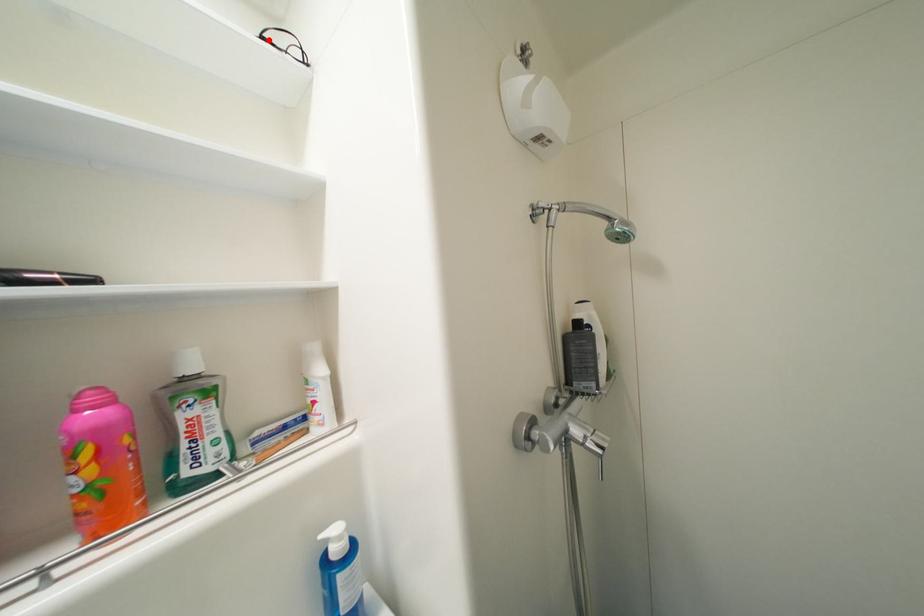
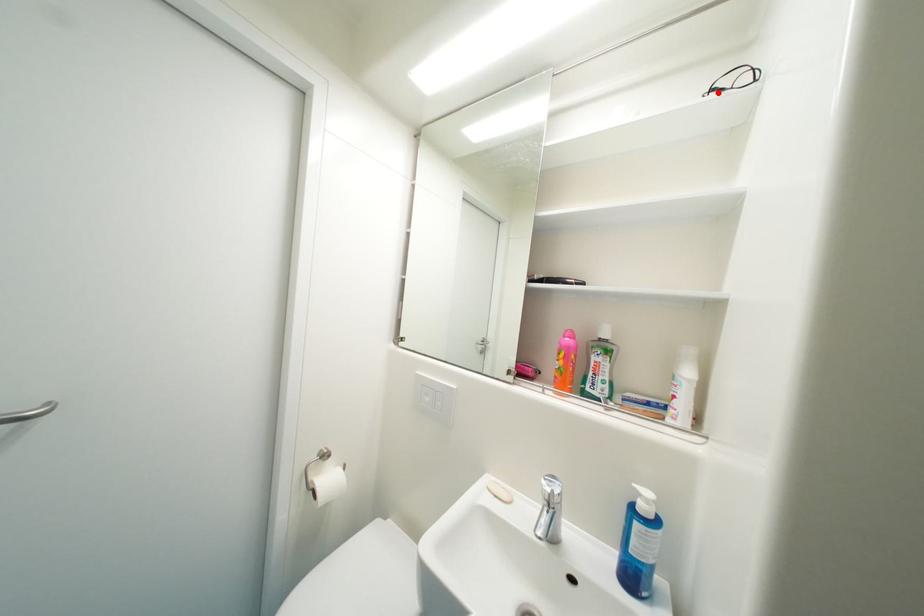
I am providing you with two images of the same scene from different viewpoints. A red point is marked on the first image and another point is marked on the second image. Are the points marked in image1 and image2 representing the same 3D position?

Yes